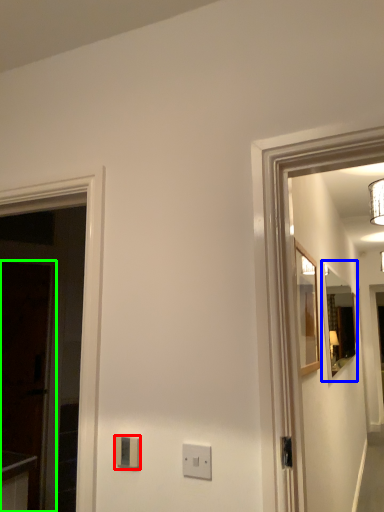
Question: Which object is positioned farthest from light switch (highlighted by a red box)? Select from mirror (highlighted by a blue box) and glass door (highlighted by a green box).

Choices:
 (A) mirror
 (B) glass door

Answer: (A)